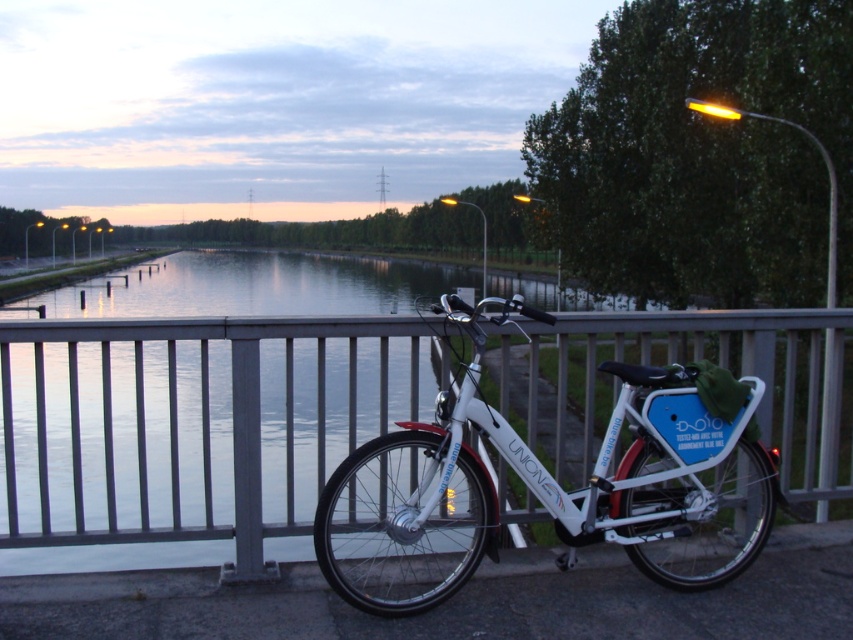
Question: Can you confirm if metallic silver fence at center is thinner than white matte bicycle at center?

Choices:
 (A) yes
 (B) no

Answer: (B)

Question: Which object is farther from the camera taking this photo?

Choices:
 (A) white matte bicycle at center
 (B) metallic silver fence at center

Answer: (B)

Question: Which point appears farthest from the camera in this image?

Choices:
 (A) (444, 435)
 (B) (13, 502)

Answer: (B)

Question: Does metallic silver fence at center come in front of white matte bicycle at center?

Choices:
 (A) no
 (B) yes

Answer: (A)

Question: Can you confirm if metallic silver fence at center is bigger than white matte bicycle at center?

Choices:
 (A) no
 (B) yes

Answer: (B)

Question: Which of the following is the closest to the observer?

Choices:
 (A) white matte bicycle at center
 (B) metallic silver fence at center

Answer: (A)